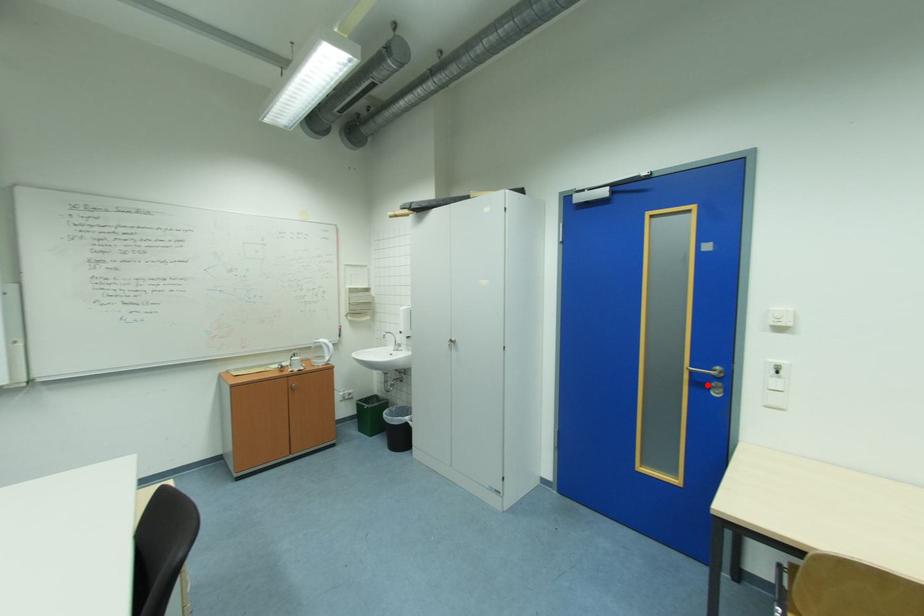
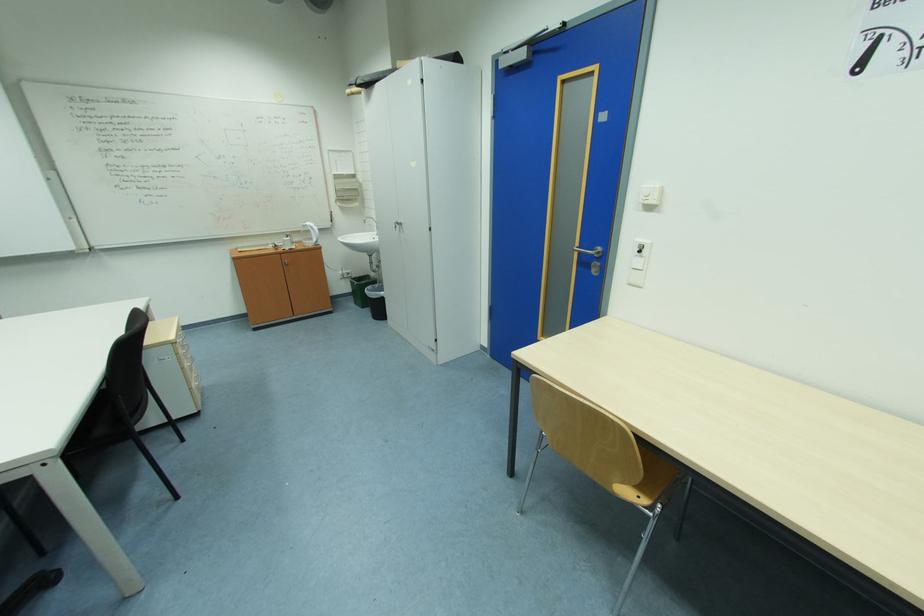
Where in the second image is the point corresponding to the highlighted location from the first image?

(590, 264)